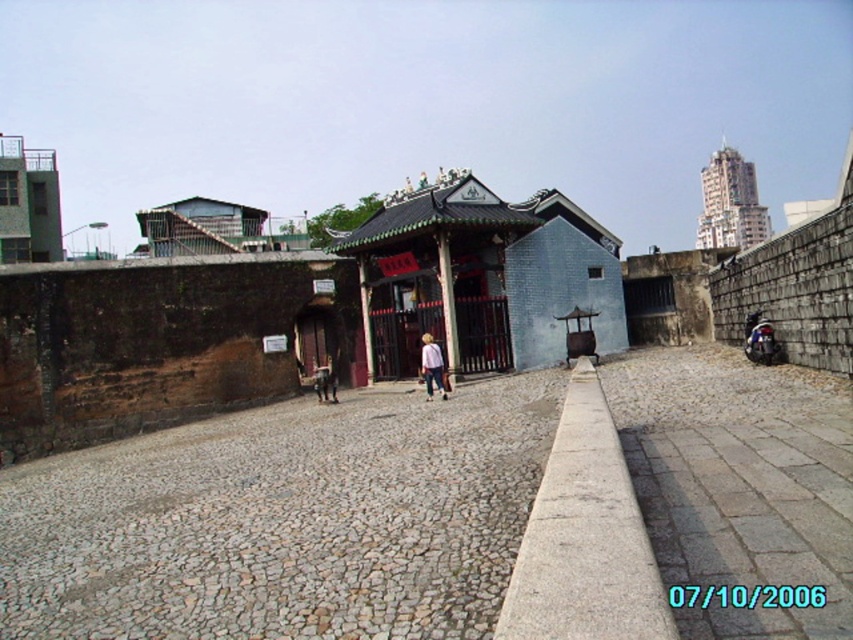
Question: Among these objects, which one is nearest to the camera?

Choices:
 (A) green concrete building at upper left
 (B) metallic gray building at upper right

Answer: (A)

Question: In this image, where is gray cobblestone alley at center located relative to shiny black motorcycle at right?

Choices:
 (A) right
 (B) left

Answer: (B)

Question: Considering the relative positions of gray stone curb at center and green concrete building at upper left in the image provided, where is gray stone curb at center located with respect to green concrete building at upper left?

Choices:
 (A) right
 (B) left

Answer: (A)

Question: Which point is farther from the camera taking this photo?

Choices:
 (A) (187, 212)
 (B) (28, 164)
 (C) (375, 422)
 (D) (622, 454)

Answer: (A)

Question: Estimate the real-world distances between objects in this image. Which object is farther from the metallic gray hut at upper left?

Choices:
 (A) metallic gray building at upper right
 (B) blue brick building at center

Answer: (A)

Question: Is blue brick building at center to the right of metallic gray hut at upper left from the viewer's perspective?

Choices:
 (A) no
 (B) yes

Answer: (B)